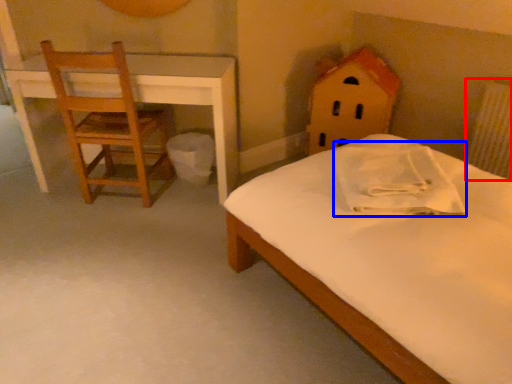
Question: Which point is further to the camera, radiator (highlighted by a red box) or pillow (highlighted by a blue box)?

Choices:
 (A) radiator
 (B) pillow

Answer: (A)